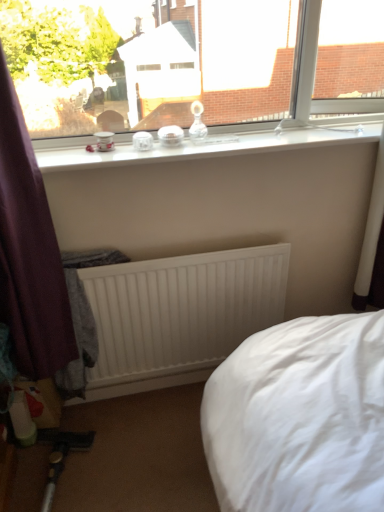
Question: In the image, is clear glass jars at upper center positioned in front of or behind white matte radiator at center?

Choices:
 (A) behind
 (B) front

Answer: (B)

Question: Is clear glass jars at upper center to the left or to the right of white matte radiator at center in the image?

Choices:
 (A) left
 (B) right

Answer: (B)

Question: Estimate the real-world distances between objects in this image. Which object is farther from the transparent glass window at upper center?

Choices:
 (A) white matte radiator at center
 (B) clear glass jars at upper center

Answer: (A)

Question: Which object is positioned closest to the clear glass jars at upper center?

Choices:
 (A) white matte radiator at center
 (B) transparent glass window at upper center

Answer: (B)